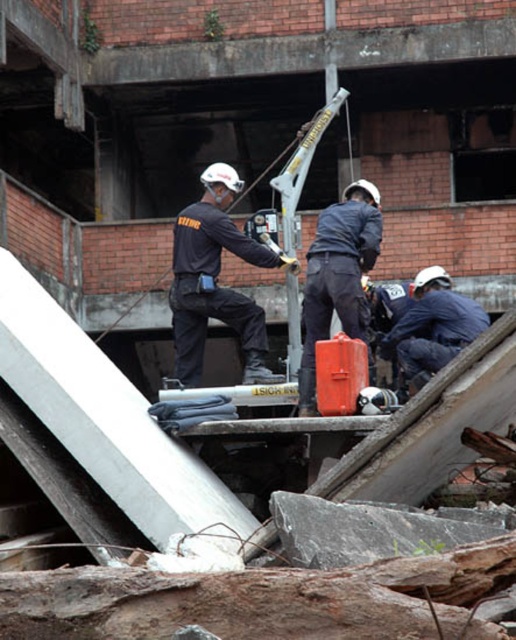
You are a rescue worker needing to assess the height of the metallic silver crane at center compared to the black matte uniform at center. Based on the scene, which one is taller?

The metallic silver crane at center is taller than the black matte uniform at center.